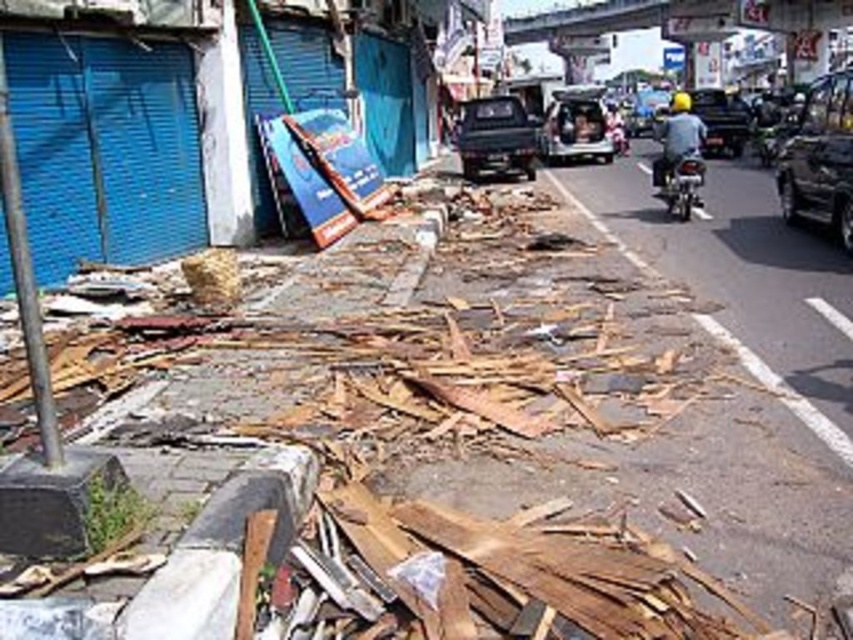
You are a delivery person trying to park your green matte van at center near the gray concrete curb at lower left. Can you park the van close enough to the curb without going over the curb?

The gray concrete curb at lower left is below green matte van at center, so the van is already positioned above the curb. Since the curb is at the lower left and the van is centered, there is enough space between them for parking without crossing the curb.

Consider the image. You are a delivery person who needs to park your shiny black car at right in a spot that is exactly 10 meters away from the camera. Can you park it in the current scene?

The shiny black car at right is 10.83 meters away from the camera, so it is slightly further than the required 10 meters. Therefore, you cannot park it in the current scene.

You are a delivery person trying to navigate through the debris on the street. You need to reach the gray concrete curb at lower left located at point (x=221, y=548). Can you safely walk around the debris pile in the foreground to reach it?

The gray concrete curb at lower left is located at point (x=221, y=548), which is the destination. The debris pile in the foreground is scattered across the pavement, but since the curb is at the lower left, you can navigate around the debris by moving along the edge of the debris towards the left side of the image where the closed storefronts with blue metal shutters are located. This path should allow safe passage to the curb.